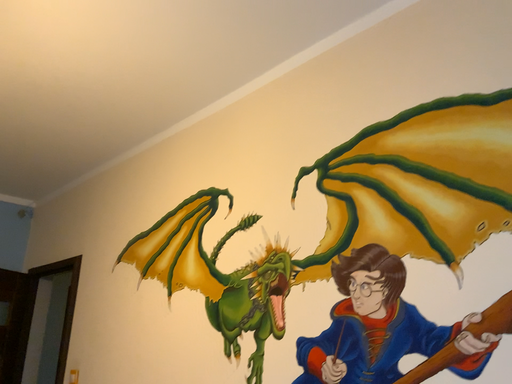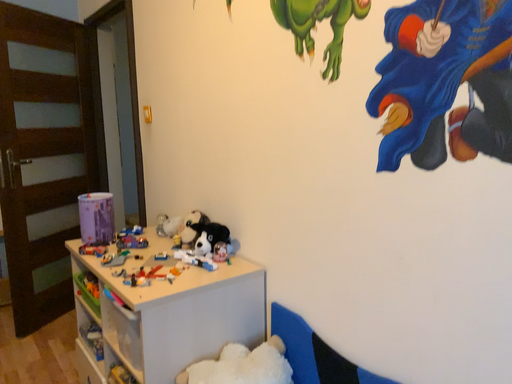
Question: How did the camera likely rotate when shooting the video?

Choices:
 (A) rotated right
 (B) rotated left

Answer: (B)